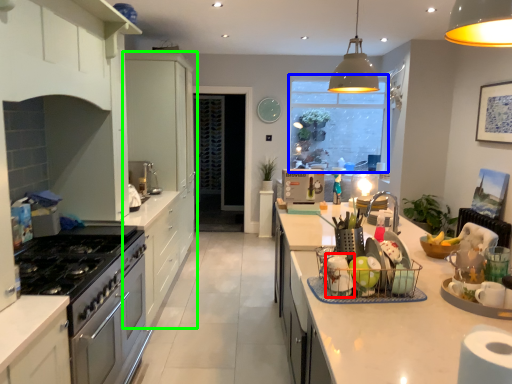
Question: Which object is positioned closest to appliance (highlighted by a red box)? Select from window screen (highlighted by a blue box) and cabinetry (highlighted by a green box).

Choices:
 (A) window screen
 (B) cabinetry

Answer: (B)